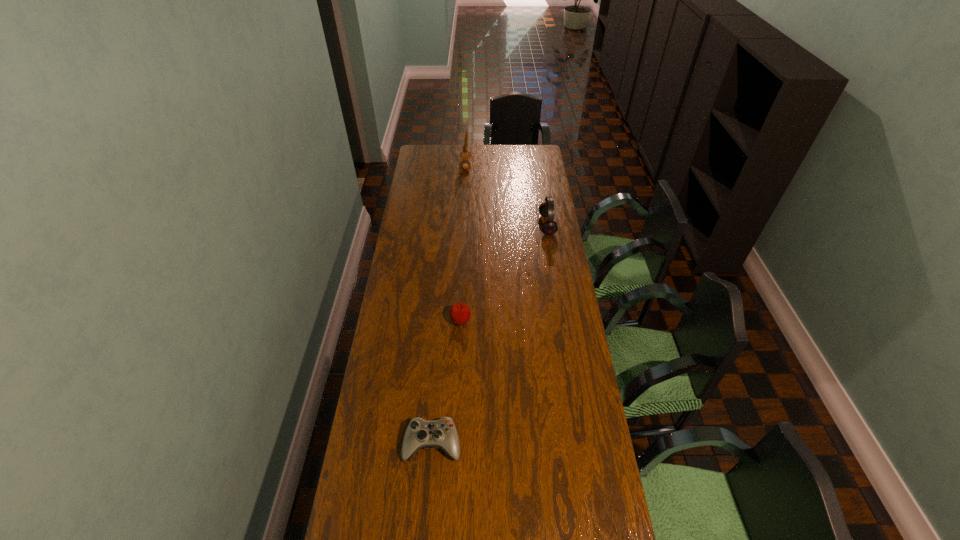
Choose which object is the nearest neighbor to the third shortest object. Please provide its 2D coordinates. Your answer should be formatted as a tuple, i.e. [(x, y)], where the tuple contains the x and y coordinates of a point satisfying the conditions above.

[(465, 155)]

I want to click on vacant space that satisfies the following two spatial constraints: 1. on the front-facing side of the farthest object; 2. on the back side of the apple, so click(x=459, y=322).

The image size is (960, 540). Find the location of `vacant point that satisfies the following two spatial constraints: 1. on the front-facing side of the farthest object; 2. on the front side of the nearest object`. vacant point that satisfies the following two spatial constraints: 1. on the front-facing side of the farthest object; 2. on the front side of the nearest object is located at coordinates (454, 443).

Identify the location of free spot that satisfies the following two spatial constraints: 1. on the front-facing side of the farthest object; 2. on the front side of the nearest object. This screenshot has height=540, width=960. (454, 443).